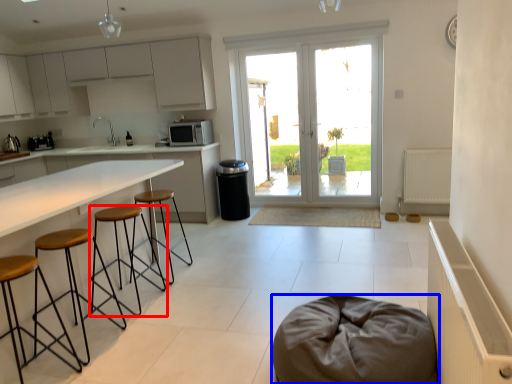
Question: Which object appears farthest to the camera in this image, stool (highlighted by a red box) or furniture (highlighted by a blue box)?

Choices:
 (A) stool
 (B) furniture

Answer: (A)